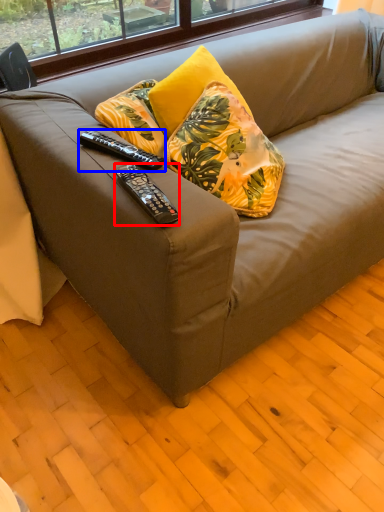
Question: Among these objects, which one is nearest to the camera, remote control (highlighted by a red box) or remote control (highlighted by a blue box)?

Choices:
 (A) remote control
 (B) remote control

Answer: (A)